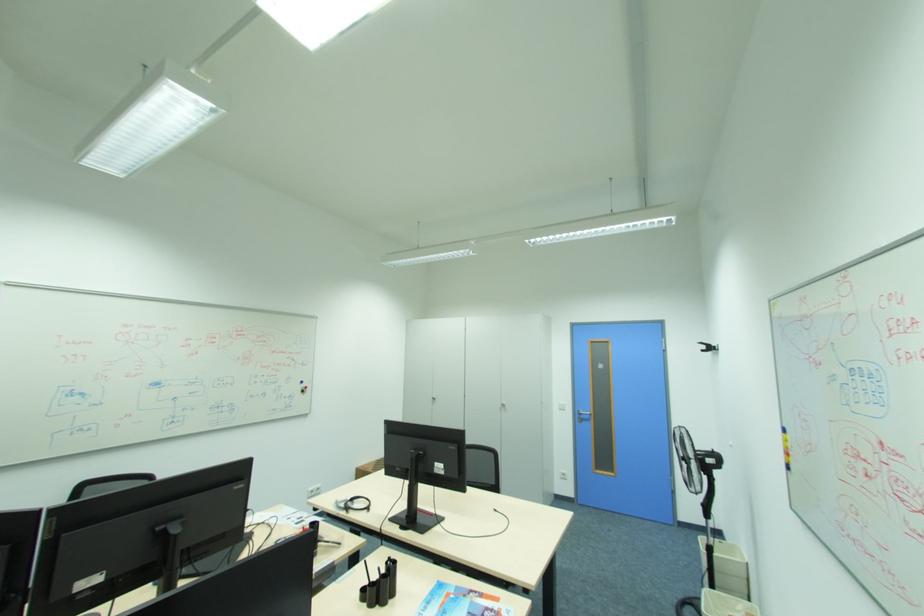
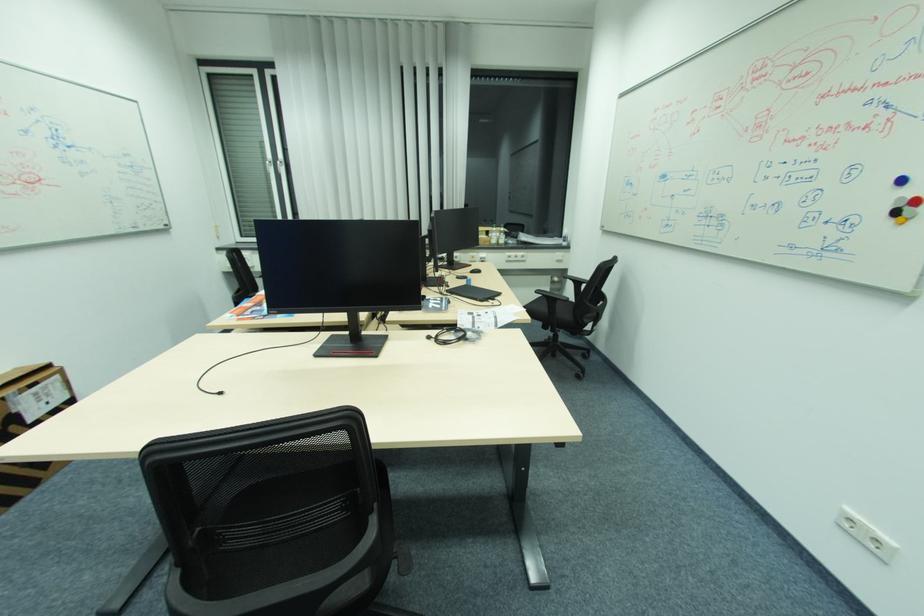
Find the pixel in the second image that matches (x=313, y=492) in the first image.

(848, 511)